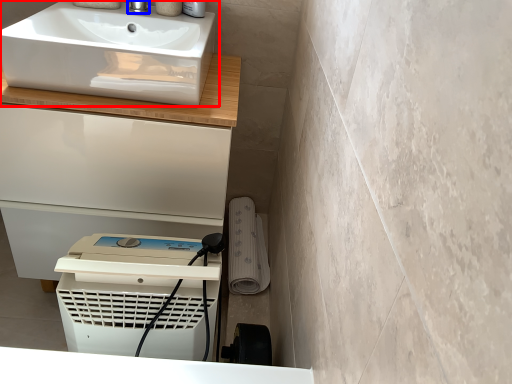
Question: Which object is further to the camera taking this photo, sink (highlighted by a red box) or tap (highlighted by a blue box)?

Choices:
 (A) sink
 (B) tap

Answer: (B)